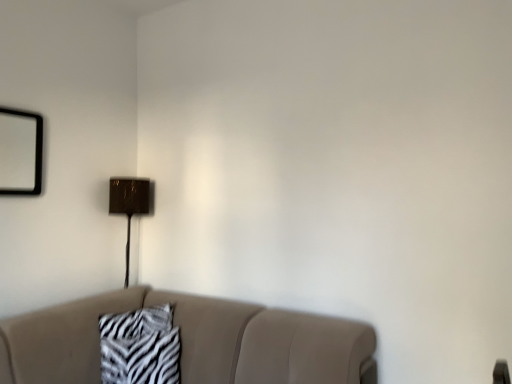
Question: From the image's perspective, relative to metallic gold table lamp at upper center, is zebra-patterned fabric at center above or below?

Choices:
 (A) below
 (B) above

Answer: (A)

Question: Considering the positions of zebra-patterned fabric at center and metallic gold table lamp at upper center in the image, is zebra-patterned fabric at center wider or thinner than metallic gold table lamp at upper center?

Choices:
 (A) thin
 (B) wide

Answer: (A)

Question: Considering the real-world distances, which object is closest to the zebra-patterned fabric at center?

Choices:
 (A) beige fabric couch at lower center
 (B) metallic gold table lamp at upper center

Answer: (A)

Question: Which of these objects is positioned farthest from the metallic gold table lamp at upper center?

Choices:
 (A) zebra-patterned fabric at center
 (B) beige fabric couch at lower center

Answer: (B)